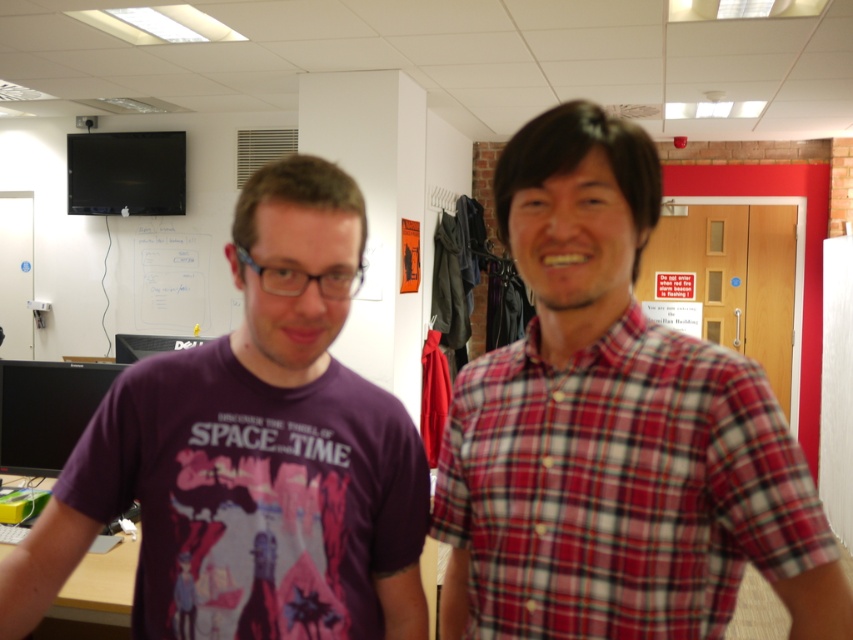
Question: In this image, where is purple cotton t-shirt at center located relative to red plaid shirt at right?

Choices:
 (A) below
 (B) above

Answer: (B)

Question: Which point is closer to the camera?

Choices:
 (A) (186, 504)
 (B) (566, 499)

Answer: (B)

Question: From the image, what is the correct spatial relationship of purple cotton t-shirt at center in relation to red plaid shirt at right?

Choices:
 (A) above
 (B) below

Answer: (A)

Question: Which object appears closest to the camera in this image?

Choices:
 (A) purple cotton t-shirt at center
 (B) red plaid shirt at right

Answer: (B)

Question: Where is purple cotton t-shirt at center located in relation to red plaid shirt at right in the image?

Choices:
 (A) right
 (B) left

Answer: (B)